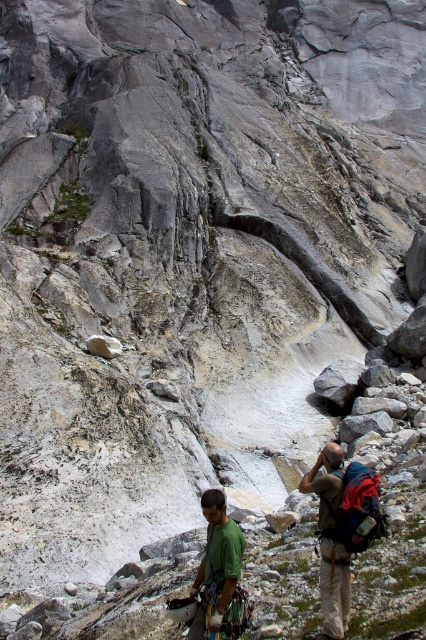
You are a hiker planning to set up a tent in this rocky area. You see the green matte shirt at lower center and the gray rough rock at center. Which object is closer to the ground?

The green matte shirt at lower center is positioned under the gray rough rock at center, so the green matte shirt at lower center is closer to the ground.

You are a hiker planning to set up a tent in the rugged, rocky landscape shown in the image. You notice a point marked at coordinates (218, 573) which is the green matte shirt at lower center. Considering the terrain described, where would you place your tent to avoid unstable ground? Please refer to the coordinates of the green matte shirt at lower center for reference.

The point marked at coordinates (218, 573) indicates the location of the green matte shirt at lower center. Since the rugged terrain has large uneven rocks and unstable ground, it is advisable to place the tent away from this area. Look for a flatter, more stable section of the terrain, possibly near the base of the rock formations where the ground is less uneven.